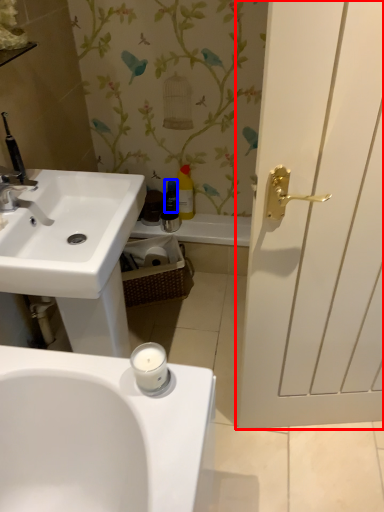
Question: Which object appears farthest to the camera in this image, door (highlighted by a red box) or toiletry (highlighted by a blue box)?

Choices:
 (A) door
 (B) toiletry

Answer: (B)